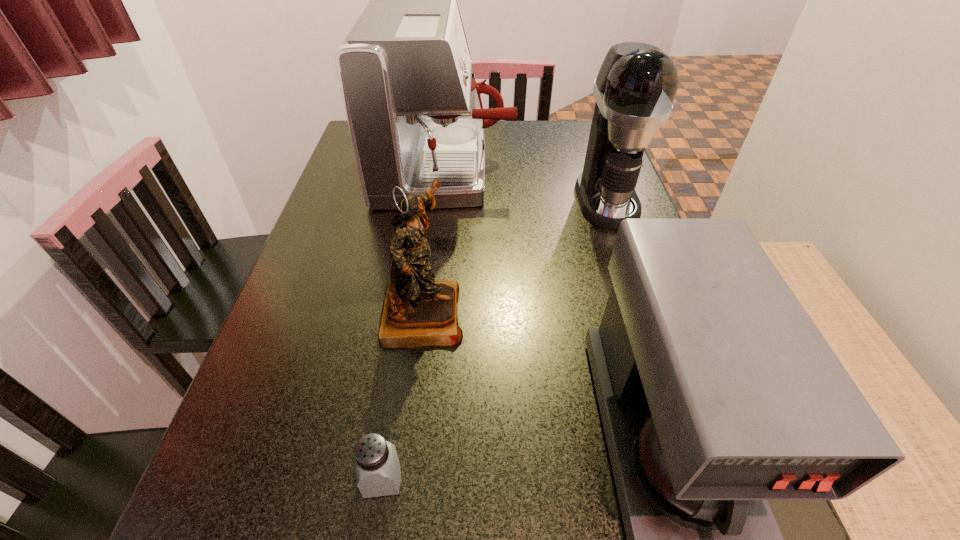
You are a GUI agent. You are given a task and a screenshot of the screen. Output one action in this format:
    pyautogui.click(x=<x>, y=<y>)
    Task: Click on the free space at the left edge of the desktop
    Image resolution: width=960 pixels, height=540 pixels.
    Given the screenshot: What is the action you would take?
    pyautogui.click(x=324, y=398)

Where is `free space at the right edge`? free space at the right edge is located at coordinates (602, 301).

Locate an element on the screen. vacant space at the far right corner of the desktop is located at coordinates (569, 153).

Find the location of a particular element. This screenshot has height=540, width=960. vacant region between the leftmost coffee maker and the figurine is located at coordinates (434, 241).

In order to click on unoccupied position between the figurine and the leftmost coffee maker in this screenshot , I will do `click(434, 241)`.

The width and height of the screenshot is (960, 540). In order to click on unoccupied position between the figurine and the leftmost coffee maker in this screenshot , I will do `click(434, 241)`.

Identify the location of object that is the third closest to the shortest object. (415, 114).

The image size is (960, 540). Identify the location of object that is the second closest to the shortest object. (717, 392).

Point out which coffee maker is positioned as the nearest to the figurine. Please provide its 2D coordinates. Your answer should be formatted as a tuple, i.e. [(x, y)], where the tuple contains the x and y coordinates of a point satisfying the conditions above.

[(415, 114)]

The width and height of the screenshot is (960, 540). I want to click on coffee maker that is the nearest to the shortest object, so click(717, 392).